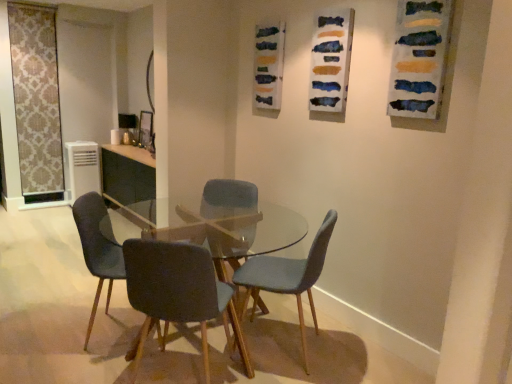
The image size is (512, 384). Find the location of `free space to the left of velvet dark blue chair at center, which is the 4th chair in right-to-left order`. free space to the left of velvet dark blue chair at center, which is the 4th chair in right-to-left order is located at coordinates (50, 330).